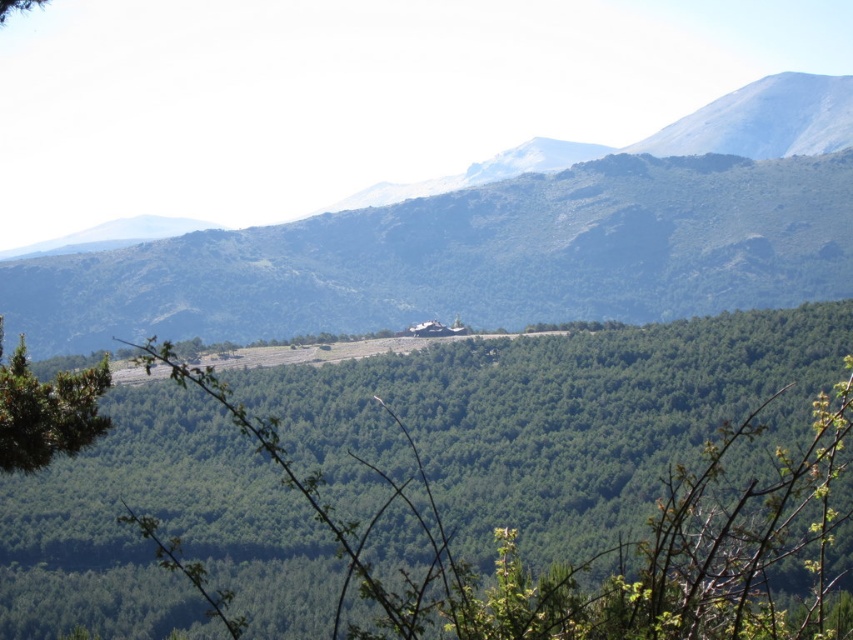
Can you confirm if green leafy tree at lower left is smaller than green leafy tree at center?

Actually, green leafy tree at lower left might be larger than green leafy tree at center.

Does green leafy tree at lower left appear on the right side of green leafy tree at center?

In fact, green leafy tree at lower left is to the left of green leafy tree at center.

Which is in front, point (32, 433) or point (618, 384)?

Point (32, 433) is more forward.

This screenshot has width=853, height=640. In order to click on green leafy tree at lower left in this screenshot , I will do `click(45, 410)`.

How far apart are green matte mountain at center and green leafy tree at center?

A distance of 249.77 meters exists between green matte mountain at center and green leafy tree at center.

Is green matte mountain at center thinner than green leafy tree at center?

No.

Where is `green matte mountain at center`? This screenshot has width=853, height=640. green matte mountain at center is located at coordinates (502, 240).

You are a GUI agent. You are given a task and a screenshot of the screen. Output one action in this format:
    pyautogui.click(x=<x>, y=<y>)
    Task: Click on the green matte mountain at center
    The image size is (853, 640).
    Given the screenshot: What is the action you would take?
    pyautogui.click(x=502, y=240)

Does green matte mountain at center have a smaller size compared to green leafy tree at lower left?

Incorrect, green matte mountain at center is not smaller in size than green leafy tree at lower left.

Can you confirm if green matte mountain at center is positioned above green leafy tree at lower left?

Yes, green matte mountain at center is above green leafy tree at lower left.

This screenshot has width=853, height=640. I want to click on green matte mountain at center, so click(x=502, y=240).

The width and height of the screenshot is (853, 640). Identify the location of green matte mountain at center. (502, 240).